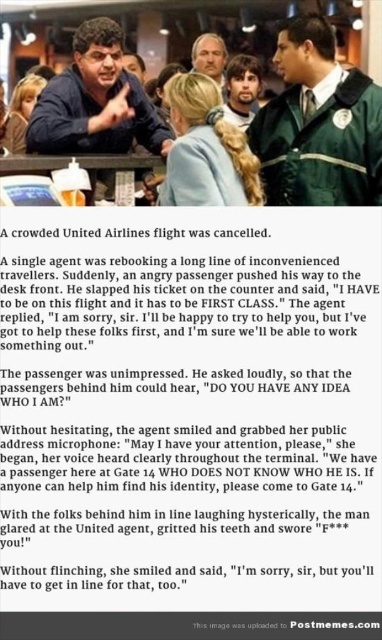
You are an airport security agent standing at the entrance. You need to direct a passenger to the nearest restroom. The restroom is located behind the green uniform at center and smooth brown hair at center. Which direction should you point to guide the passenger?

The green uniform at center is to the right of smooth brown hair at center. Therefore, you should point to the right side of smooth brown hair at center to direct the passenger towards the restroom located behind the green uniform at center.

You are at the airport check in area and see a point marked at coordinates (189, 410). What object is this point located on?

The point is located on the black paper at center.